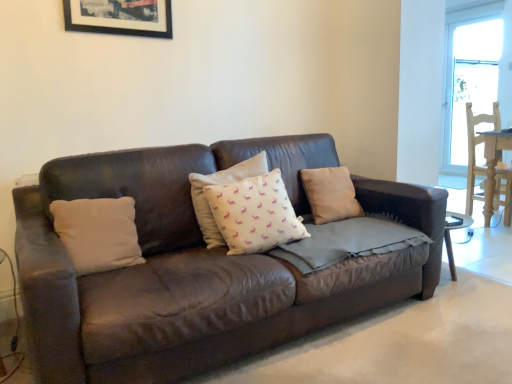
Describe the element at coordinates (120, 17) in the screenshot. The height and width of the screenshot is (384, 512). I see `black matte picture frame at upper center` at that location.

The height and width of the screenshot is (384, 512). What do you see at coordinates (195, 267) in the screenshot?
I see `brown leather couch at center` at bounding box center [195, 267].

What are the coordinates of `white fabric pillow with pink patterns at center, which is the second pillow in right-to-left order` in the screenshot? It's located at (254, 214).

Locate an element on the screen. This screenshot has height=384, width=512. black matte picture frame at upper center is located at coordinates (120, 17).

From a real-world perspective, which object stands above the other?

white cotton cushion at center, the third pillow viewed from the right, is physically above.

Can you confirm if white fabric pillow with pink patterns at center, which is the second pillow in right-to-left order, is shorter than white cotton cushion at center, the third pillow viewed from the right?

Correct, white fabric pillow with pink patterns at center, which is the second pillow in right-to-left order, is not as tall as white cotton cushion at center, the third pillow viewed from the right.

Are white fabric pillow with pink patterns at center, which is the third pillow from left to right, and white cotton cushion at center, which ranks as the 2th pillow in left-to-right order, far apart?

No.

Consider the image. Is white fabric pillow with pink patterns at center, which is the third pillow from left to right, wider than white cotton cushion at center, the third pillow viewed from the right?

Indeed, white fabric pillow with pink patterns at center, which is the third pillow from left to right, has a greater width compared to white cotton cushion at center, the third pillow viewed from the right.

Considering the sizes of objects beige fabric pillow at center, positioned as the 4th pillow in left-to-right order, and white fabric pillow with pink patterns at center, which is the third pillow from left to right, in the image provided, who is taller, beige fabric pillow at center, positioned as the 4th pillow in left-to-right order, or white fabric pillow with pink patterns at center, which is the third pillow from left to right,?

white fabric pillow with pink patterns at center, which is the third pillow from left to right, is taller.

Which object is more forward, beige fabric pillow at center, positioned as the 4th pillow in left-to-right order, or white fabric pillow with pink patterns at center, which is the third pillow from left to right?

white fabric pillow with pink patterns at center, which is the third pillow from left to right, is closer to the camera.

Based on the photo, who is smaller, beige fabric pillow at center, the first pillow when ordered from right to left, or white fabric pillow with pink patterns at center, which is the second pillow in right-to-left order?

beige fabric pillow at center, the first pillow when ordered from right to left.

How much distance is there between beige fabric pillow at center, the first pillow when ordered from right to left, and white fabric pillow with pink patterns at center, which is the second pillow in right-to-left order?

The distance of beige fabric pillow at center, the first pillow when ordered from right to left, from white fabric pillow with pink patterns at center, which is the second pillow in right-to-left order, is 19.74 inches.

Considering the sizes of objects white cotton pillow at left, placed as the 4th pillow when sorted from right to left, and white cotton cushion at center, which ranks as the 2th pillow in left-to-right order, in the image provided, who is thinner, white cotton pillow at left, placed as the 4th pillow when sorted from right to left, or white cotton cushion at center, which ranks as the 2th pillow in left-to-right order,?

white cotton cushion at center, which ranks as the 2th pillow in left-to-right order.

Can you tell me how much white cotton pillow at left, placed as the 4th pillow when sorted from right to left, and white cotton cushion at center, the third pillow viewed from the right, differ in facing direction?

The angular difference between white cotton pillow at left, placed as the 4th pillow when sorted from right to left, and white cotton cushion at center, the third pillow viewed from the right, is 0.215 degrees.

Is point (123, 232) farther from viewer compared to point (254, 168)?

No, it is in front of (254, 168).

Considering the relative positions of white cotton pillow at left, which ranks as the first pillow in left-to-right order, and white cotton cushion at center, the third pillow viewed from the right, in the image provided, is white cotton pillow at left, which ranks as the first pillow in left-to-right order, to the right of white cotton cushion at center, the third pillow viewed from the right, from the viewer's perspective?

Incorrect, white cotton pillow at left, which ranks as the first pillow in left-to-right order, is not on the right side of white cotton cushion at center, the third pillow viewed from the right.

In the scene shown: From a real-world perspective, which object stands above the other?

black matte picture frame at upper center.

Is black matte picture frame at upper center to the left or to the right of beige fabric pillow at center, the first pillow when ordered from right to left, in the image?

black matte picture frame at upper center is positioned on beige fabric pillow at center, the first pillow when ordered from right to left,'s left side.

Can you confirm if black matte picture frame at upper center is shorter than beige fabric pillow at center, the first pillow when ordered from right to left?

Indeed, black matte picture frame at upper center has a lesser height compared to beige fabric pillow at center, the first pillow when ordered from right to left.

Is black matte picture frame at upper center facing away from beige fabric pillow at center, the first pillow when ordered from right to left?

black matte picture frame at upper center is not turned away from beige fabric pillow at center, the first pillow when ordered from right to left.

Does white fabric pillow with pink patterns at center, which is the third pillow from left to right, have a greater height compared to beige fabric pillow at center, the first pillow when ordered from right to left?

Correct, white fabric pillow with pink patterns at center, which is the third pillow from left to right, is much taller as beige fabric pillow at center, the first pillow when ordered from right to left.

Consider the image. Which point is more forward, (243, 206) or (327, 199)?

The point (243, 206) is closer.

Based on the photo, from the image's perspective, is white fabric pillow with pink patterns at center, which is the third pillow from left to right, above or below beige fabric pillow at center, positioned as the 4th pillow in left-to-right order?

white fabric pillow with pink patterns at center, which is the third pillow from left to right, is below beige fabric pillow at center, positioned as the 4th pillow in left-to-right order.

Based on their sizes in the image, would you say white fabric pillow with pink patterns at center, which is the second pillow in right-to-left order, is bigger or smaller than beige fabric pillow at center, the first pillow when ordered from right to left?

Clearly, white fabric pillow with pink patterns at center, which is the second pillow in right-to-left order, is larger in size than beige fabric pillow at center, the first pillow when ordered from right to left.

Is black matte picture frame at upper center not close to white fabric pillow with pink patterns at center, which is the third pillow from left to right?

Yes, black matte picture frame at upper center is far from white fabric pillow with pink patterns at center, which is the third pillow from left to right.

From a real-world perspective, relative to white fabric pillow with pink patterns at center, which is the second pillow in right-to-left order, is black matte picture frame at upper center vertically above or below?

From a real-world perspective, black matte picture frame at upper center is physically above white fabric pillow with pink patterns at center, which is the second pillow in right-to-left order.

Which is in front, black matte picture frame at upper center or white fabric pillow with pink patterns at center, which is the second pillow in right-to-left order?

white fabric pillow with pink patterns at center, which is the second pillow in right-to-left order, is closer to the camera.

From the image's perspective, is black matte picture frame at upper center above or below white fabric pillow with pink patterns at center, which is the second pillow in right-to-left order?

black matte picture frame at upper center is above white fabric pillow with pink patterns at center, which is the second pillow in right-to-left order.

Considering the sizes of objects black matte picture frame at upper center and white cotton cushion at center, which ranks as the 2th pillow in left-to-right order, in the image provided, who is taller, black matte picture frame at upper center or white cotton cushion at center, which ranks as the 2th pillow in left-to-right order,?

With more height is white cotton cushion at center, which ranks as the 2th pillow in left-to-right order.

Is black matte picture frame at upper center smaller than white cotton cushion at center, which ranks as the 2th pillow in left-to-right order?

Yes.

Between black matte picture frame at upper center and white cotton cushion at center, the third pillow viewed from the right, which one appears on the left side from the viewer's perspective?

From the viewer's perspective, black matte picture frame at upper center appears more on the left side.

Is black matte picture frame at upper center with white cotton cushion at center, the third pillow viewed from the right?

No, black matte picture frame at upper center is not making contact with white cotton cushion at center, the third pillow viewed from the right.

You are a GUI agent. You are given a task and a screenshot of the screen. Output one action in this format:
    pyautogui.click(x=<x>, y=<y>)
    Task: Click on the 1st pillow in front when counting from the white cotton cushion at center, the third pillow viewed from the right
    This screenshot has width=512, height=384.
    Given the screenshot: What is the action you would take?
    pyautogui.click(x=254, y=214)

You are a GUI agent. You are given a task and a screenshot of the screen. Output one action in this format:
    pyautogui.click(x=<x>, y=<y>)
    Task: Click on the pillow that is the 2nd one when counting backward from the white fabric pillow with pink patterns at center, which is the third pillow from left to right
    
    Given the screenshot: What is the action you would take?
    pyautogui.click(x=330, y=194)

When comparing their distances from white fabric pillow with pink patterns at center, which is the third pillow from left to right, does white cotton pillow at left, placed as the 4th pillow when sorted from right to left, or black matte picture frame at upper center seem closer?

white cotton pillow at left, placed as the 4th pillow when sorted from right to left, lies closer to white fabric pillow with pink patterns at center, which is the third pillow from left to right, than the other object.

Considering their positions, is white fabric pillow with pink patterns at center, which is the third pillow from left to right, positioned closer to black matte picture frame at upper center than beige fabric pillow at center, the first pillow when ordered from right to left?

white fabric pillow with pink patterns at center, which is the third pillow from left to right.

Consider the image. From the image, which object appears to be nearer to white fabric pillow with pink patterns at center, which is the third pillow from left to right, white cotton pillow at left, which ranks as the first pillow in left-to-right order, or white cotton cushion at center, which ranks as the 2th pillow in left-to-right order?

Among the two, white cotton cushion at center, which ranks as the 2th pillow in left-to-right order, is located nearer to white fabric pillow with pink patterns at center, which is the third pillow from left to right.

Consider the image. Based on their spatial positions, is brown leather couch at center or white cotton pillow at left, which ranks as the first pillow in left-to-right order, closer to beige fabric pillow at center, positioned as the 4th pillow in left-to-right order?

brown leather couch at center.

From the image, which object appears to be farther from white cotton cushion at center, which ranks as the 2th pillow in left-to-right order, beige fabric pillow at center, the first pillow when ordered from right to left, or black matte picture frame at upper center?

The object further to white cotton cushion at center, which ranks as the 2th pillow in left-to-right order, is black matte picture frame at upper center.

Estimate the real-world distances between objects in this image. Which object is further from brown leather couch at center, black matte picture frame at upper center or white cotton pillow at left, which ranks as the first pillow in left-to-right order?

Based on the image, black matte picture frame at upper center appears to be further to brown leather couch at center.

From the image, which object appears to be farther from white fabric pillow with pink patterns at center, which is the third pillow from left to right, brown leather couch at center or beige fabric pillow at center, positioned as the 4th pillow in left-to-right order?

beige fabric pillow at center, positioned as the 4th pillow in left-to-right order.

Based on their spatial positions, is black matte picture frame at upper center or brown leather couch at center closer to white cotton pillow at left, which ranks as the first pillow in left-to-right order?

The object closer to white cotton pillow at left, which ranks as the first pillow in left-to-right order, is brown leather couch at center.

This screenshot has height=384, width=512. Find the location of `picture frame between brown leather couch at center and beige fabric pillow at center, the first pillow when ordered from right to left, in the front-back direction`. picture frame between brown leather couch at center and beige fabric pillow at center, the first pillow when ordered from right to left, in the front-back direction is located at coordinates (120, 17).

Locate an element on the screen. The image size is (512, 384). pillow located between white cotton pillow at left, which ranks as the first pillow in left-to-right order, and white fabric pillow with pink patterns at center, which is the second pillow in right-to-left order, in the left-right direction is located at coordinates (221, 184).

You are a GUI agent. You are given a task and a screenshot of the screen. Output one action in this format:
    pyautogui.click(x=<x>, y=<y>)
    Task: Click on the pillow between brown leather couch at center and white fabric pillow with pink patterns at center, which is the third pillow from left to right, in the front-back direction
    
    Given the screenshot: What is the action you would take?
    pyautogui.click(x=98, y=233)

You are a GUI agent. You are given a task and a screenshot of the screen. Output one action in this format:
    pyautogui.click(x=<x>, y=<y>)
    Task: Click on the pillow located between white cotton cushion at center, the third pillow viewed from the right, and beige fabric pillow at center, positioned as the 4th pillow in left-to-right order, in the left-right direction
    This screenshot has width=512, height=384.
    Given the screenshot: What is the action you would take?
    pyautogui.click(x=254, y=214)